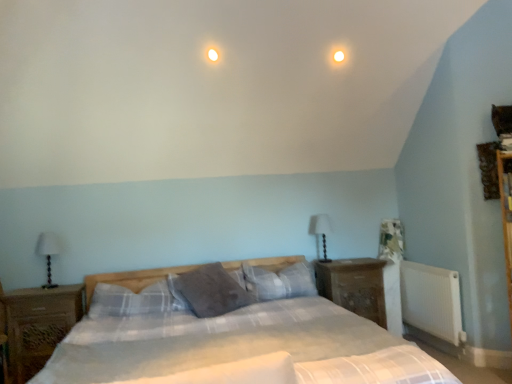
How much space does wooden nightstand at left, positioned as the 1th nightstand in left-to-right order, occupy vertically?

81.40 centimeters.

This screenshot has height=384, width=512. What do you see at coordinates (38, 325) in the screenshot?
I see `wooden nightstand at left, marked as the 2th nightstand in a back-to-front arrangement` at bounding box center [38, 325].

The height and width of the screenshot is (384, 512). Describe the element at coordinates (130, 300) in the screenshot. I see `plaid fabric pillow at center, the 1th pillow from the left` at that location.

What is the approximate width of white fabric-covered table lamp at center-right, positioned as the 2th table lamp in left-to-right order?

It is 6.72 inches.

The image size is (512, 384). What do you see at coordinates (321, 231) in the screenshot? I see `white fabric-covered table lamp at center-right, the second table lamp from the front` at bounding box center [321, 231].

This screenshot has height=384, width=512. What do you see at coordinates (339, 56) in the screenshot?
I see `white glossy light at upper center` at bounding box center [339, 56].

Describe the element at coordinates (279, 282) in the screenshot. This screenshot has width=512, height=384. I see `plaid fabric pillow at center, marked as the third pillow in a left-to-right arrangement` at that location.

This screenshot has height=384, width=512. I want to click on white plastic radiator at lower right, so click(432, 300).

The image size is (512, 384). What do you see at coordinates (432, 300) in the screenshot?
I see `white plastic radiator at lower right` at bounding box center [432, 300].

The image size is (512, 384). I want to click on wooden nightstand at left, marked as the 2th nightstand in a back-to-front arrangement, so click(38, 325).

Is white fabric lampshade at left, acting as the second table lamp starting from the right, behind wooden nightstand at left, positioned as the 1th nightstand in left-to-right order?

Yes, white fabric lampshade at left, acting as the second table lamp starting from the right, is further from the viewer.

Is wooden nightstand at left, marked as the first nightstand in a front-to-back arrangement, inside white fabric lampshade at left, which ranks as the first table lamp in front-to-back order?

No, white fabric lampshade at left, which ranks as the first table lamp in front-to-back order, does not contain wooden nightstand at left, marked as the first nightstand in a front-to-back arrangement.

Is point (47, 235) in front of point (37, 330)?

No.

Considering the sizes of objects white fabric lampshade at left, the 1th table lamp in the left-to-right sequence, and wooden nightstand at left, which is the second nightstand from right to left, in the image provided, who is taller, white fabric lampshade at left, the 1th table lamp in the left-to-right sequence, or wooden nightstand at left, which is the second nightstand from right to left,?

With more height is wooden nightstand at left, which is the second nightstand from right to left.

Is wooden nightstand at right, which is the 1th nightstand in back-to-front order, not near plaid fabric bed at center?

No.

Who is bigger, wooden nightstand at right, the 2th nightstand from the left, or plaid fabric bed at center?

plaid fabric bed at center is bigger.

How distant is wooden nightstand at right, the 2th nightstand from the left, from plaid fabric bed at center?

A distance of 94.75 centimeters exists between wooden nightstand at right, the 2th nightstand from the left, and plaid fabric bed at center.

From a real-world perspective, is wooden nightstand at right, which is counted as the first nightstand, starting from the right, on plaid fabric bed at center?

Correct, in the physical world, wooden nightstand at right, which is counted as the first nightstand, starting from the right, is higher than plaid fabric bed at center.

Between plaid fabric bed at center and plaid fabric pillow at center, the 1th pillow positioned from the right, which one appears on the left side from the viewer's perspective?

plaid fabric bed at center is more to the left.

Are plaid fabric bed at center and plaid fabric pillow at center, marked as the third pillow in a left-to-right arrangement, beside each other?

No.

Is plaid fabric bed at center wider than plaid fabric pillow at center, the 1th pillow positioned from the right?

Indeed, plaid fabric bed at center has a greater width compared to plaid fabric pillow at center, the 1th pillow positioned from the right.

Considering the sizes of objects wooden nightstand at left, positioned as the 1th nightstand in left-to-right order, and white fabric lampshade at left, which ranks as the first table lamp in front-to-back order, in the image provided, who is shorter, wooden nightstand at left, positioned as the 1th nightstand in left-to-right order, or white fabric lampshade at left, which ranks as the first table lamp in front-to-back order,?

white fabric lampshade at left, which ranks as the first table lamp in front-to-back order, is shorter.

How many degrees apart are the facing directions of wooden nightstand at left, marked as the 2th nightstand in a back-to-front arrangement, and white fabric lampshade at left, marked as the 2th table lamp in a back-to-front arrangement?

0.385 degrees separate the facing orientations of wooden nightstand at left, marked as the 2th nightstand in a back-to-front arrangement, and white fabric lampshade at left, marked as the 2th table lamp in a back-to-front arrangement.

Where is `the 2nd nightstand below when counting from the white fabric lampshade at left, which ranks as the first table lamp in front-to-back order (from the image's perspective)`? This screenshot has width=512, height=384. the 2nd nightstand below when counting from the white fabric lampshade at left, which ranks as the first table lamp in front-to-back order (from the image's perspective) is located at coordinates (38, 325).

From the image's perspective, which is below, wooden nightstand at left, marked as the 2th nightstand in a back-to-front arrangement, or white fabric lampshade at left, marked as the 2th table lamp in a back-to-front arrangement?

wooden nightstand at left, marked as the 2th nightstand in a back-to-front arrangement, appears lower in the image.

From a real-world perspective, which is physically below, plaid fabric pillow at center, marked as the third pillow in a left-to-right arrangement, or white plastic radiator at lower right?

From a 3D spatial view, white plastic radiator at lower right is below.

Could you measure the distance between plaid fabric pillow at center, marked as the third pillow in a left-to-right arrangement, and white plastic radiator at lower right?

A distance of 3.67 feet exists between plaid fabric pillow at center, marked as the third pillow in a left-to-right arrangement, and white plastic radiator at lower right.

Is plaid fabric pillow at center, marked as the third pillow in a left-to-right arrangement, placed right next to white plastic radiator at lower right?

A: No, plaid fabric pillow at center, marked as the third pillow in a left-to-right arrangement, is not in contact with white plastic radiator at lower right.

Could you tell me if plaid fabric pillow at center, marked as the third pillow in a left-to-right arrangement, is facing white plastic radiator at lower right?

No, plaid fabric pillow at center, marked as the third pillow in a left-to-right arrangement, does not turn towards white plastic radiator at lower right.

Looking at this image, considering the sizes of objects plaid fabric pillow at center, marked as the third pillow in a left-to-right arrangement, and plaid fabric bed at center in the image provided, who is wider, plaid fabric pillow at center, marked as the third pillow in a left-to-right arrangement, or plaid fabric bed at center?

Wider between the two is plaid fabric bed at center.

From a real-world perspective, which is physically above, plaid fabric pillow at center, marked as the third pillow in a left-to-right arrangement, or plaid fabric bed at center?

In real-world perspective, plaid fabric pillow at center, marked as the third pillow in a left-to-right arrangement, is above.

Considering the sizes of plaid fabric pillow at center, marked as the third pillow in a left-to-right arrangement, and plaid fabric bed at center in the image, is plaid fabric pillow at center, marked as the third pillow in a left-to-right arrangement, taller or shorter than plaid fabric bed at center?

plaid fabric pillow at center, marked as the third pillow in a left-to-right arrangement, is shorter than plaid fabric bed at center.

Between plaid fabric pillow at center, marked as the third pillow in a left-to-right arrangement, and plaid fabric bed at center, which one is positioned behind?

plaid fabric pillow at center, marked as the third pillow in a left-to-right arrangement.

From a real-world perspective, between white fabric lampshade at left, the 1th table lamp in the left-to-right sequence, and plaid fabric bed at center, who is vertically higher?

From a 3D spatial view, white fabric lampshade at left, the 1th table lamp in the left-to-right sequence, is above.

Can you confirm if white fabric lampshade at left, which ranks as the first table lamp in front-to-back order, is shorter than plaid fabric bed at center?

Yes, white fabric lampshade at left, which ranks as the first table lamp in front-to-back order, is shorter than plaid fabric bed at center.

Can you tell me how much white fabric lampshade at left, acting as the second table lamp starting from the right, and plaid fabric bed at center differ in facing direction?

The angular difference between white fabric lampshade at left, acting as the second table lamp starting from the right, and plaid fabric bed at center is 1.83 degrees.

Which point is more distant from viewer, (47, 249) or (264, 311)?

The point (47, 249) is behind.

Image resolution: width=512 pixels, height=384 pixels. In order to click on nightstand that is the 2nd one below the white fabric lampshade at left, the 1th table lamp in the left-to-right sequence (from a real-world perspective) in this screenshot , I will do `click(38, 325)`.

Find the location of `nightstand on the right of plaid fabric bed at center`. nightstand on the right of plaid fabric bed at center is located at coordinates (354, 286).

Based on their spatial positions, is wooden nightstand at right, which is counted as the first nightstand, starting from the right, or white fabric-covered table lamp at center-right, the 1th table lamp when ordered from back to front, further from white plastic radiator at lower right?

Based on the image, white fabric-covered table lamp at center-right, the 1th table lamp when ordered from back to front, appears to be further to white plastic radiator at lower right.

Looking at the image, which one is located further to white fabric lampshade at left, acting as the second table lamp starting from the right, plaid fabric bed at center or plaid fabric pillow at center, marked as the third pillow in a left-to-right arrangement?

plaid fabric pillow at center, marked as the third pillow in a left-to-right arrangement, is further to white fabric lampshade at left, acting as the second table lamp starting from the right.

Estimate the real-world distances between objects in this image. Which object is closer to wooden nightstand at right, the 2th nightstand from the left, wooden nightstand at left, positioned as the 1th nightstand in left-to-right order, or gray soft pillow at center, arranged as the second pillow when viewed from the right?

gray soft pillow at center, arranged as the second pillow when viewed from the right, lies closer to wooden nightstand at right, the 2th nightstand from the left, than the other object.

When comparing their distances from plaid fabric pillow at center, which is the third pillow from right to left, does plaid fabric pillow at center, the 1th pillow positioned from the right, or white fabric-covered table lamp at center-right, positioned as the 2th table lamp in left-to-right order, seem closer?

Among the two, plaid fabric pillow at center, the 1th pillow positioned from the right, is located nearer to plaid fabric pillow at center, which is the third pillow from right to left.

Consider the image. Which object lies further to the anchor point wooden nightstand at left, marked as the 2th nightstand in a back-to-front arrangement, plaid fabric pillow at center, which is the third pillow from right to left, or white fabric-covered table lamp at center-right, the 1th table lamp when ordered from back to front?

white fabric-covered table lamp at center-right, the 1th table lamp when ordered from back to front, is positioned further to the anchor wooden nightstand at left, marked as the 2th nightstand in a back-to-front arrangement.

Considering their positions, is wooden nightstand at right, which is the 1th nightstand in back-to-front order, positioned closer to plaid fabric bed at center than wooden nightstand at left, positioned as the 1th nightstand in left-to-right order?

Based on the image, wooden nightstand at left, positioned as the 1th nightstand in left-to-right order, appears to be nearer to plaid fabric bed at center.

Considering their positions, is white glossy light at upper center positioned further to wooden nightstand at right, the 2th nightstand from the left, than plaid fabric bed at center?

white glossy light at upper center lies further to wooden nightstand at right, the 2th nightstand from the left, than the other object.

Considering their positions, is gray soft pillow at center, arranged as the second pillow when viewed from the right, positioned further to white plastic radiator at lower right than wooden nightstand at right, the 2th nightstand from the left?

gray soft pillow at center, arranged as the second pillow when viewed from the right, lies further to white plastic radiator at lower right than the other object.

Locate an element on the screen. bed between plaid fabric pillow at center, the 1th pillow from the left, and white plastic radiator at lower right is located at coordinates (232, 341).

Locate an element on the screen. The width and height of the screenshot is (512, 384). radiator between plaid fabric bed at center and plaid fabric pillow at center, marked as the third pillow in a left-to-right arrangement, from front to back is located at coordinates (432, 300).

Where is `bed between wooden nightstand at left, which is the second nightstand from right to left, and wooden nightstand at right, arranged as the 2th nightstand when viewed from the front`? This screenshot has height=384, width=512. bed between wooden nightstand at left, which is the second nightstand from right to left, and wooden nightstand at right, arranged as the 2th nightstand when viewed from the front is located at coordinates (232, 341).

Identify the location of table lamp located between wooden nightstand at left, marked as the 2th nightstand in a back-to-front arrangement, and white plastic radiator at lower right in the left-right direction. This screenshot has height=384, width=512. (321, 231).